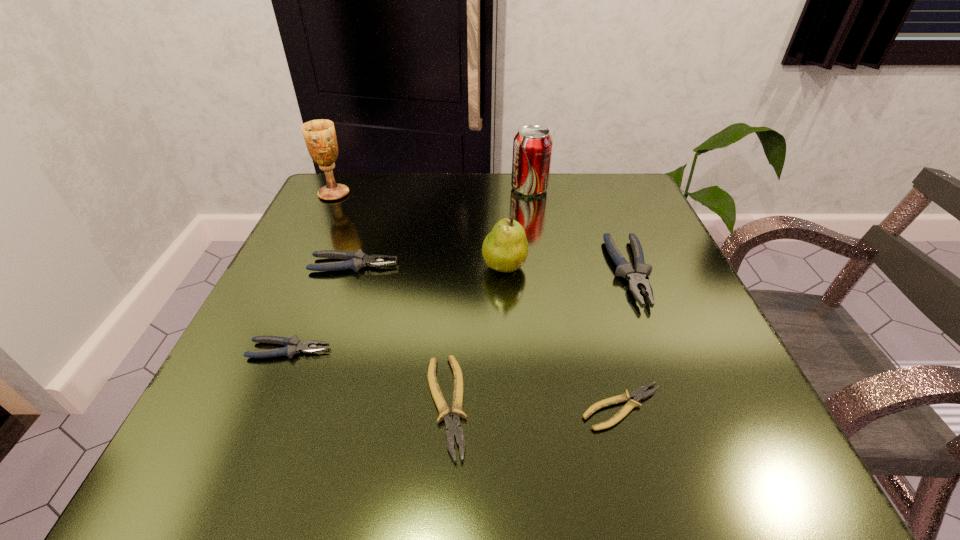
Identify the location of chalice. (320, 137).

Locate an element on the screen. This screenshot has width=960, height=540. the seventh shortest object is located at coordinates point(532,146).

This screenshot has width=960, height=540. What are the coordinates of `pear` in the screenshot? It's located at (505, 249).

Find the location of a particular element. the fourth tallest object is located at coordinates (637, 278).

Locate an element on the screen. This screenshot has width=960, height=540. the tallest pliers is located at coordinates (637, 278).

This screenshot has width=960, height=540. I want to click on the fourth shortest pliers, so click(355, 260).

You are a GUI agent. You are given a task and a screenshot of the screen. Output one action in this format:
    pyautogui.click(x=<x>, y=<y>)
    Task: Click on the fifth tallest object
    Image resolution: width=960 pixels, height=540 pixels.
    Given the screenshot: What is the action you would take?
    pyautogui.click(x=355, y=260)

At what (x,y) coordinates should I click in order to perform the action: click on the third shortest object. Please return your answer as a coordinate pair (x, y). Looking at the image, I should click on (294, 345).

You are a GUI agent. You are given a task and a screenshot of the screen. Output one action in this format:
    pyautogui.click(x=<x>, y=<y>)
    Task: Click on the nearest gray pliers
    The image size is (960, 540).
    Given the screenshot: What is the action you would take?
    pyautogui.click(x=294, y=345)

You are a GUI agent. You are given a task and a screenshot of the screen. Output one action in this format:
    pyautogui.click(x=<x>, y=<y>)
    Task: Click on the seventh tallest object
    Image resolution: width=960 pixels, height=540 pixels.
    Given the screenshot: What is the action you would take?
    pyautogui.click(x=453, y=427)